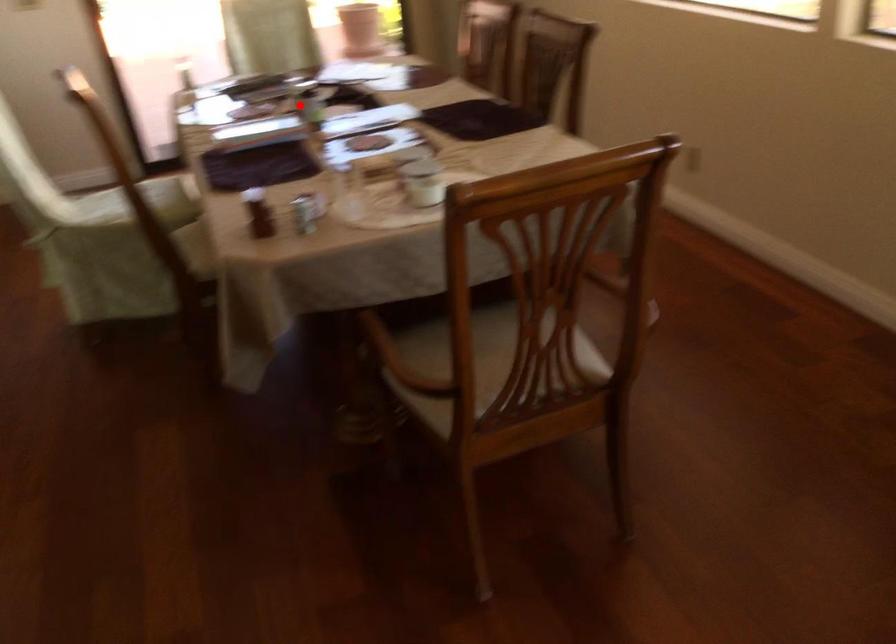
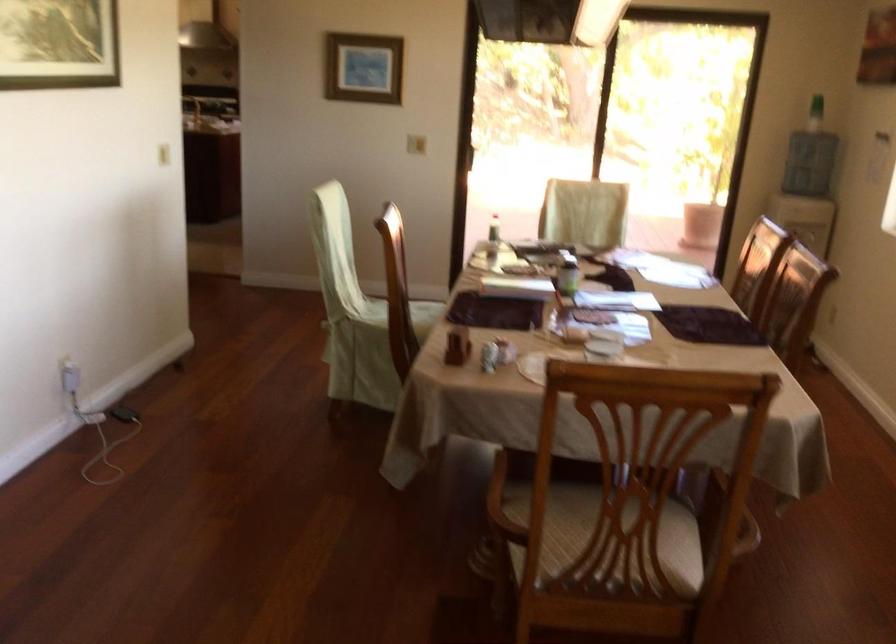
Question: A red point is marked in image1. In image2, is the corresponding 3D point closer to the camera or farther? Reply with the corresponding letter.

Choices:
 (A) The corresponding 3D point is closer.
 (B) The corresponding 3D point is farther.

Answer: (B)